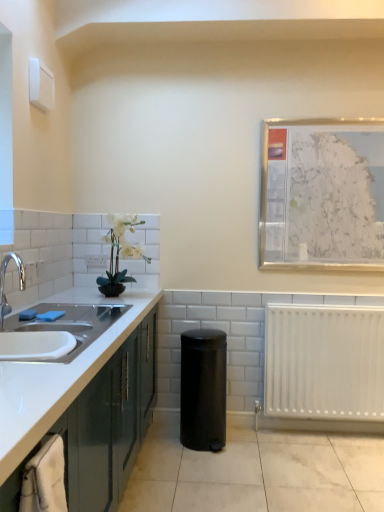
Question: From the image's perspective, is white plastic electric outlet at upper left above or below black matte trash can at center?

Choices:
 (A) below
 (B) above

Answer: (B)

Question: Considering the relative positions of white plastic electric outlet at upper left and black matte trash can at center in the image provided, is white plastic electric outlet at upper left to the left or to the right of black matte trash can at center?

Choices:
 (A) left
 (B) right

Answer: (A)

Question: Estimate the real-world distances between objects in this image. Which object is farther from the white matte plant at upper left?

Choices:
 (A) white plastic radiator at lower right
 (B) white plastic electric outlet at upper left
 (C) black matte trash can at center
 (D) white ceramic sink at left
 (E) matte green cabinetry at left

Answer: (A)

Question: Which object is the closest to the white plastic radiator at lower right?

Choices:
 (A) white matte plant at upper left
 (B) black matte trash can at center
 (C) white ceramic sink at left
 (D) metallic silver map at upper right
 (E) white plastic electric outlet at upper left

Answer: (B)